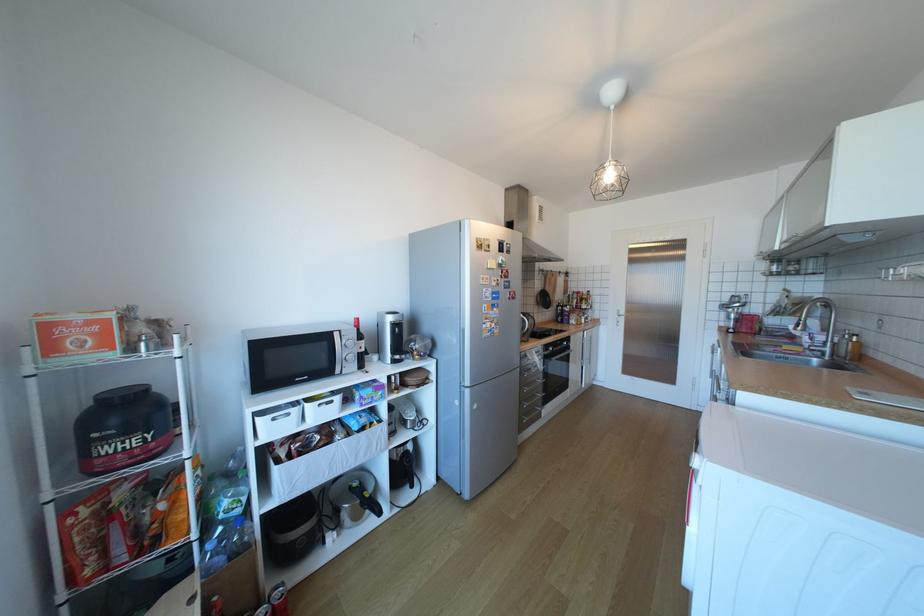
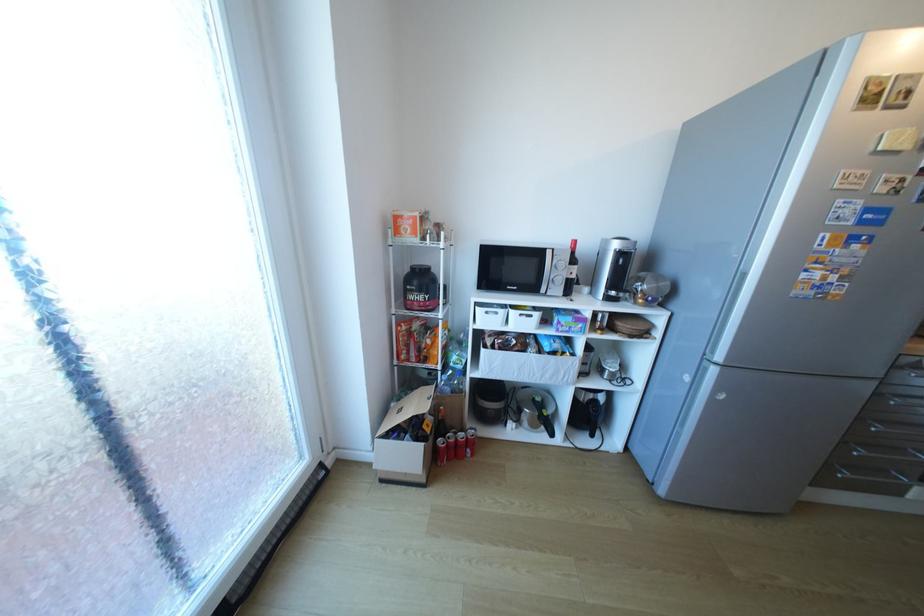
Locate, in the second image, the point that corresponds to (x=341, y=402) in the first image.

(540, 315)